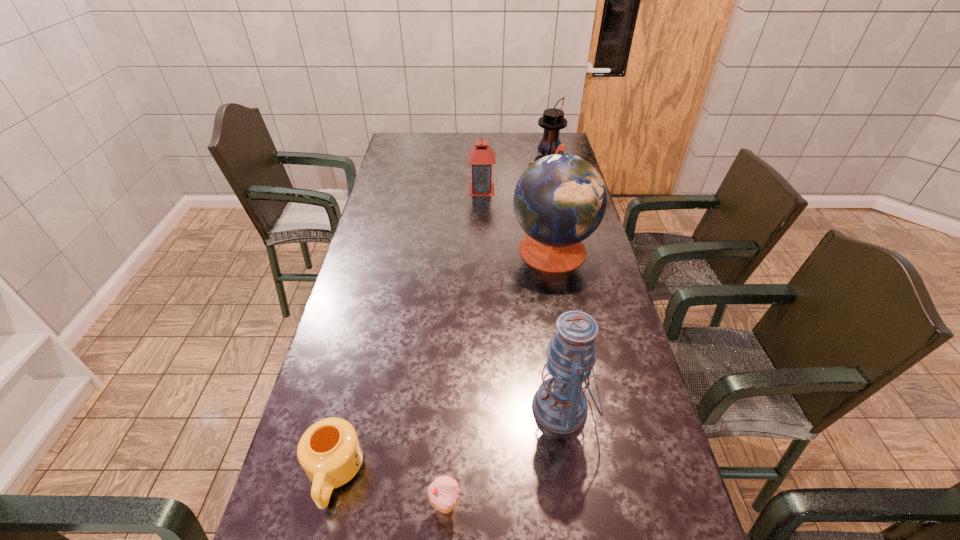
Where is `vacant space at the far edge`? The width and height of the screenshot is (960, 540). vacant space at the far edge is located at coordinates (460, 135).

Identify the location of vacant area at the left edge of the desktop. The height and width of the screenshot is (540, 960). (343, 515).

In order to click on free spot at the right edge of the desktop in this screenshot , I will do `click(614, 431)`.

Where is `vacant area at the far left corner`? The height and width of the screenshot is (540, 960). vacant area at the far left corner is located at coordinates (392, 151).

The image size is (960, 540). I want to click on vacant region at the far right corner, so click(x=537, y=144).

Locate an element on the screen. The width and height of the screenshot is (960, 540). vacant region between the third shortest object and the nearest lantern is located at coordinates (522, 299).

I want to click on vacant area that lies between the globe and the mug, so click(x=444, y=361).

Where is `empty space between the third farthest object and the mug`? empty space between the third farthest object and the mug is located at coordinates coord(444,361).

At what (x,y) coordinates should I click in order to perform the action: click on vacant space that's between the nearest lantern and the leftmost object. Please return your answer as a coordinate pair (x, y). Looking at the image, I should click on (448, 441).

The width and height of the screenshot is (960, 540). Identify the location of vacant area between the farthest object and the nearest lantern. (554, 290).